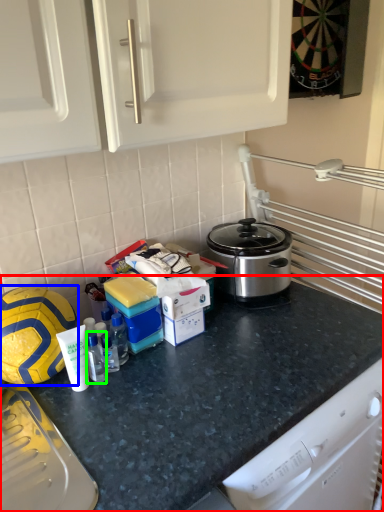
Question: Based on their relative distances, which object is farther from countertop (highlighted by a red box)? Choose from football (highlighted by a blue box) and bottle (highlighted by a green box).

Choices:
 (A) football
 (B) bottle

Answer: (A)